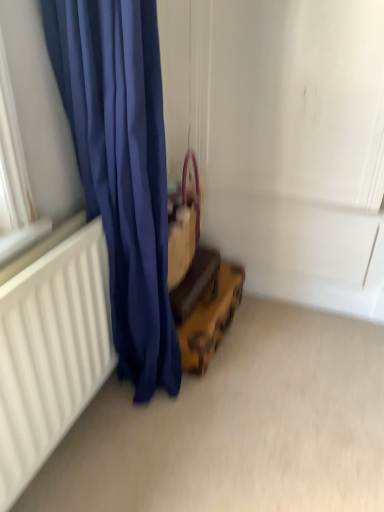
I want to click on wooden suitcase at lower center, so click(195, 283).

The image size is (384, 512). What do you see at coordinates (195, 283) in the screenshot?
I see `wooden suitcase at lower center` at bounding box center [195, 283].

In order to face wooden suitcase at lower center, should I rotate leftwards or rightwards?

To align with it, rotate left about 0.327°.

Find the location of `wooden suitcase at lower center`. wooden suitcase at lower center is located at coordinates (195, 283).